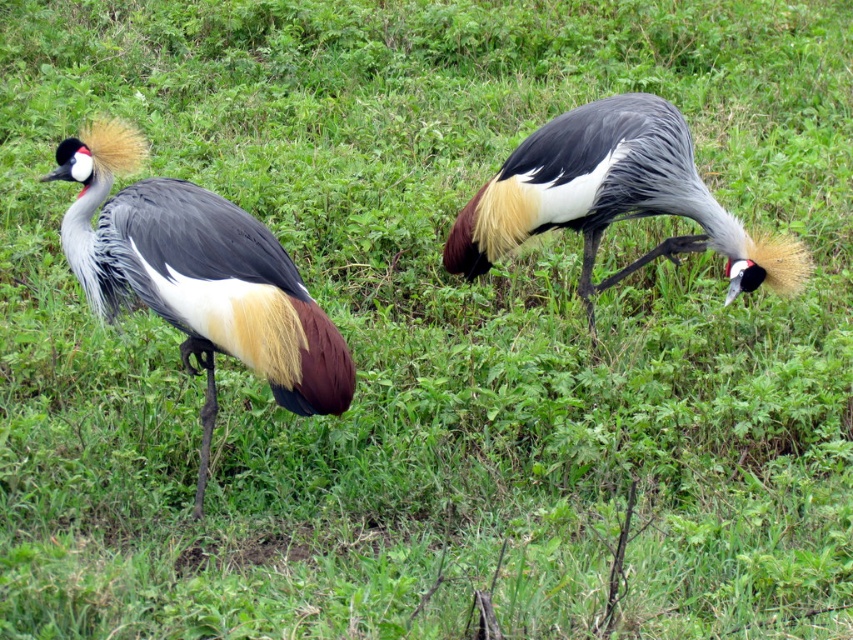
You are a wildlife photographer observing two grey crowned cranes in their natural habitat. You notice a matte gray and white bird at left and a matte gray crane at center. Which of these birds is positioned lower in the image?

The matte gray and white bird at left is positioned lower than the matte gray crane at center.

You are a wildlife photographer trying to capture both the matte gray and white bird at left and the matte gray crane at center in a single frame. Given that your camera has a fixed focal length, which bird should you focus on first to ensure both are in focus, considering their sizes?

The matte gray and white bird at left is larger in size than the matte gray crane at center. To ensure both are in focus, you should focus on the larger bird first, as focusing on the closer or larger subject helps maintain depth of field for the smaller one.

You are a wildlife photographer standing 3 meters away from a matte gray and white bird at left. You want to capture a closeup shot without disturbing it. Can you move closer than 3 meters to take the photo?

The matte gray and white bird at left and viewer are 3.05 meters apart, so you can move slightly closer to 3 meters or just beyond to take the photo without disturbing it, as 3.05 meters is already very close.